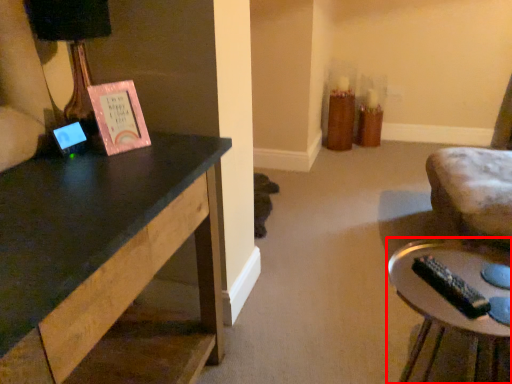
Question: Where is table (annotated by the red box) located in relation to table lamp in the image?

Choices:
 (A) right
 (B) left

Answer: (A)